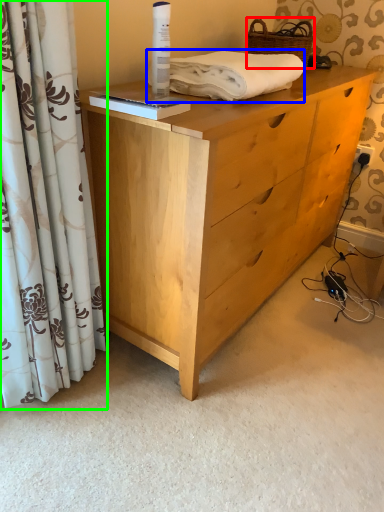
Question: Based on their relative distances, which object is farther from basket (highlighted by a red box)? Choose from bath towel (highlighted by a blue box) and curtain (highlighted by a green box).

Choices:
 (A) bath towel
 (B) curtain

Answer: (B)